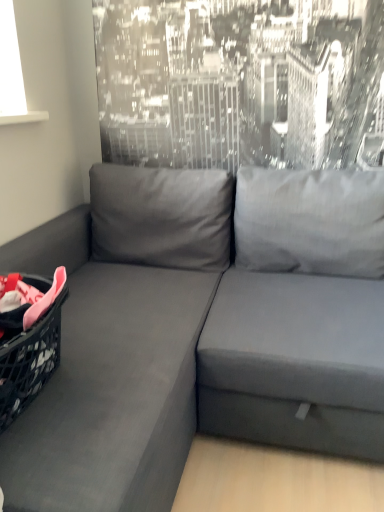
Question: Considering the relative positions of suede gray couch at left and plastic black laundry basket at left in the image provided, is suede gray couch at left in front of plastic black laundry basket at left?

Choices:
 (A) yes
 (B) no

Answer: (A)

Question: Does suede gray couch at left have a lesser height compared to plastic black laundry basket at left?

Choices:
 (A) yes
 (B) no

Answer: (B)

Question: From the image's perspective, is suede gray couch at left on top of plastic black laundry basket at left?

Choices:
 (A) yes
 (B) no

Answer: (B)

Question: Considering the relative sizes of suede gray couch at left and plastic black laundry basket at left in the image provided, is suede gray couch at left smaller than plastic black laundry basket at left?

Choices:
 (A) no
 (B) yes

Answer: (A)

Question: Is suede gray couch at left positioned behind plastic black laundry basket at left?

Choices:
 (A) yes
 (B) no

Answer: (B)

Question: Considering the relative positions of suede gray couch at left and plastic black laundry basket at left in the image provided, is suede gray couch at left to the left of plastic black laundry basket at left from the viewer's perspective?

Choices:
 (A) yes
 (B) no

Answer: (B)

Question: Is plastic black laundry basket at left not close to suede gray couch at left?

Choices:
 (A) yes
 (B) no

Answer: (B)

Question: Can you confirm if plastic black laundry basket at left is shorter than suede gray couch at left?

Choices:
 (A) yes
 (B) no

Answer: (A)

Question: Does plastic black laundry basket at left have a smaller size compared to suede gray couch at left?

Choices:
 (A) no
 (B) yes

Answer: (B)

Question: From the image's perspective, is plastic black laundry basket at left on top of suede gray couch at left?

Choices:
 (A) no
 (B) yes

Answer: (B)

Question: Is suede gray couch at left at the back of plastic black laundry basket at left?

Choices:
 (A) no
 (B) yes

Answer: (B)

Question: Does plastic black laundry basket at left appear on the right side of suede gray couch at left?

Choices:
 (A) yes
 (B) no

Answer: (B)

Question: From a real-world perspective, relative to plastic black laundry basket at left, is suede gray couch at left vertically above or below?

Choices:
 (A) below
 (B) above

Answer: (A)